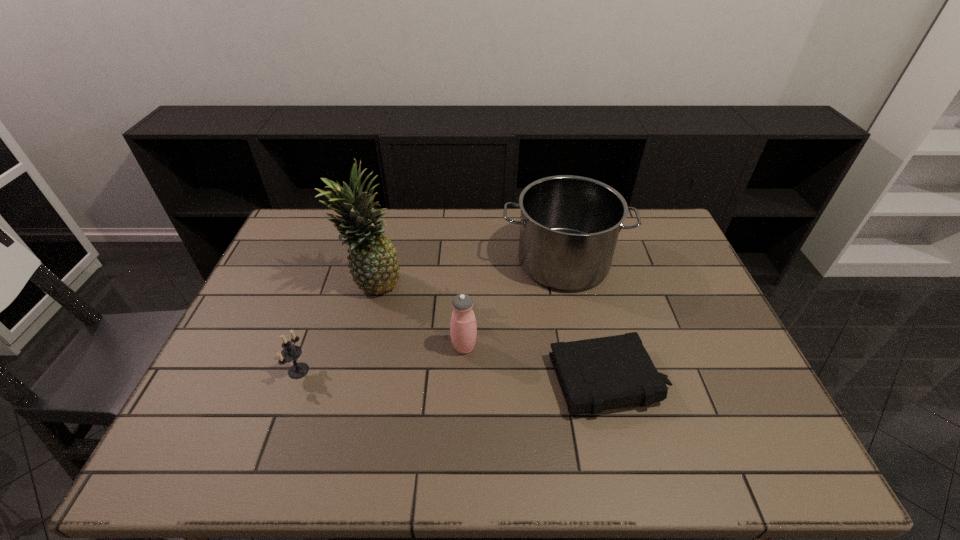
What are the coordinates of `the second object from left to right` in the screenshot? It's located at (373, 261).

Find the location of a particular element. The image size is (960, 540). the tallest object is located at coordinates tap(373, 261).

Locate an element on the screen. saucepan is located at coordinates click(x=569, y=225).

The height and width of the screenshot is (540, 960). Identify the location of the third object from right to left. (463, 328).

Find the location of a particular element. Image resolution: width=960 pixels, height=540 pixels. the third tallest object is located at coordinates (463, 328).

Image resolution: width=960 pixels, height=540 pixels. What are the coordinates of `candle holder` in the screenshot? It's located at (290, 353).

Where is `the leftmost object`? This screenshot has height=540, width=960. the leftmost object is located at coordinates (290, 353).

Locate an element on the screen. This screenshot has width=960, height=540. Bible is located at coordinates (597, 374).

The image size is (960, 540). I want to click on free region located on the front of the pineapple, so click(353, 357).

I want to click on free space located on the left of the saucepan, so click(483, 262).